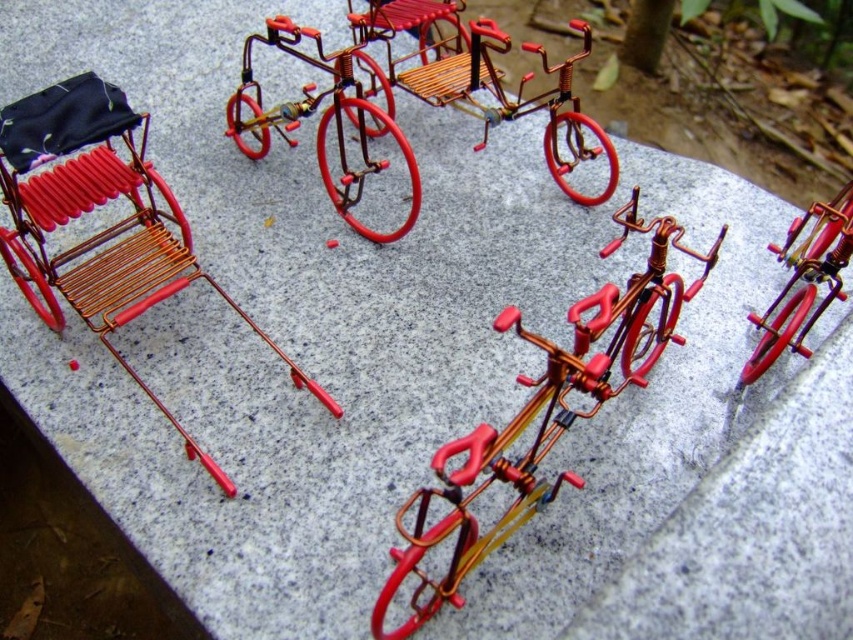
Question: Is matte copper chair at left to the left of metallic wire tricycle at center from the viewer's perspective?

Choices:
 (A) no
 (B) yes

Answer: (B)

Question: Considering the real-world distances, which object is farthest from the copper wire bicycle at center?

Choices:
 (A) metallic wire tricycle at center
 (B) metallic red bicycle at center

Answer: (A)

Question: Does copper wire bicycle at center have a smaller size compared to metallic wire tricycle at center?

Choices:
 (A) no
 (B) yes

Answer: (B)

Question: Can you confirm if copper wire bicycle at center is positioned above metallic wire tricycle at center?

Choices:
 (A) yes
 (B) no

Answer: (B)

Question: Among these objects, which one is nearest to the camera?

Choices:
 (A) metallic wire tricycle at center
 (B) copper wire bicycle at center

Answer: (B)

Question: Considering the real-world distances, which object is farthest from the copper wire bicycle at center?

Choices:
 (A) metallic wire tricycle at center
 (B) metallic red bicycle at center

Answer: (A)